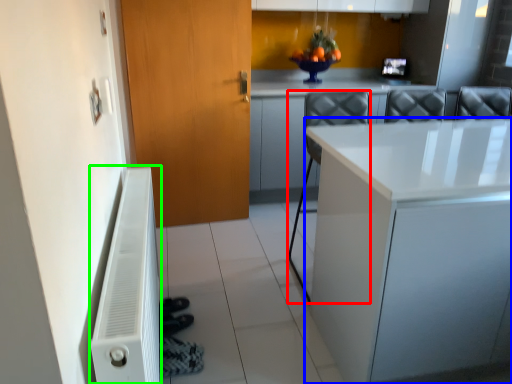
Question: Which is nearer to the chair (highlighted by a red box)? countertop (highlighted by a blue box) or radiator (highlighted by a green box).

Choices:
 (A) countertop
 (B) radiator

Answer: (A)